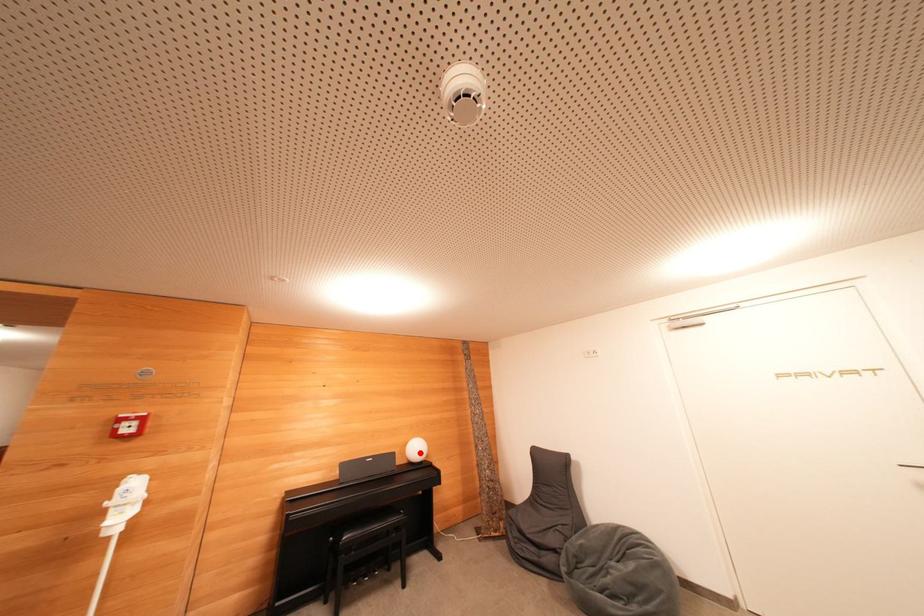
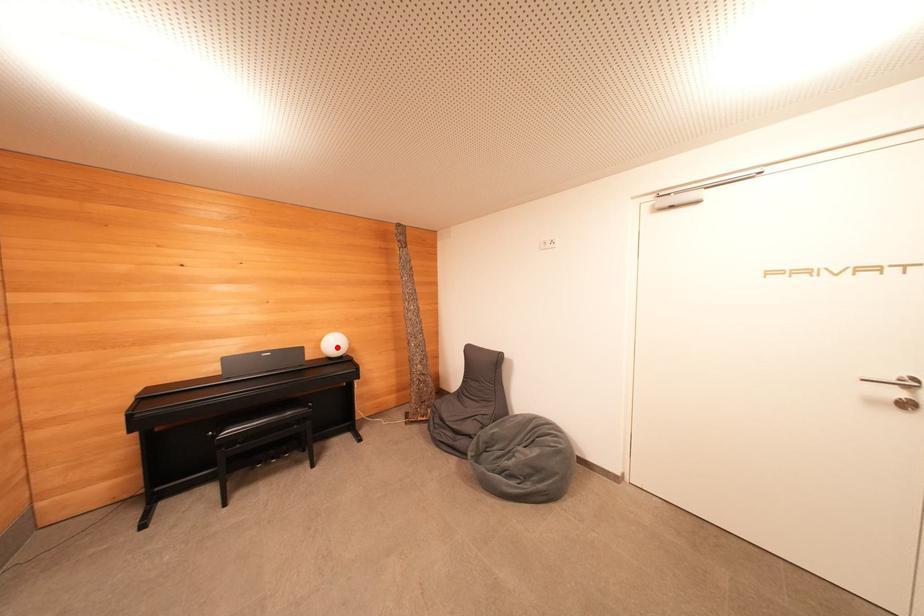
I am providing you with two images of the same scene from different viewpoints. A red point is marked on the first image and another point is marked on the second image. Do the highlighted points in image1 and image2 indicate the same real-world spot?

Yes